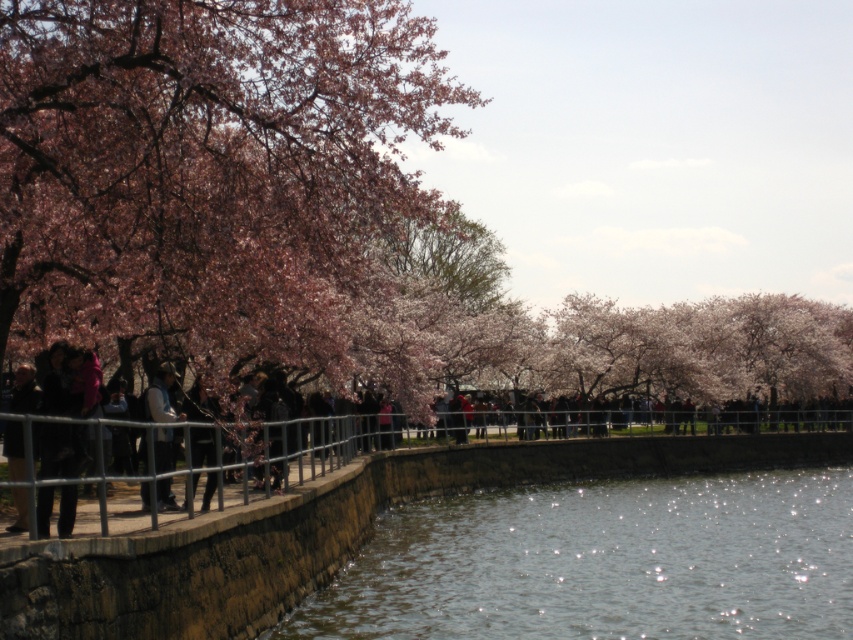
You are standing on the walkway and want to reach both the point at coordinates point (33,456) and point (155,390). Which point should you go to first to minimize your walking distance?

You should go to point (33,456) first because it is closer to the viewer than point (155,390), so it requires less walking distance.

You are a photographer standing on the walkway near the water. You want to take a photo that includes both the dark brown leather jacket at left and the denim jacket at center. Given that your camera has a maximum focus range of 9 feet, will you be able to capture both subjects in the same frame without moving?

The distance between the dark brown leather jacket at left and denim jacket at center is 8.99 feet, which is within the camera maximum focus range of 9 feet. Yes, you can capture both subjects in the same frame without moving.

Based on the photo, you are standing at the center of the walkway and want to take a photo of the pink blossoms at left. In which direction should you move to get closer to them?

The pink blossoms at left are located at point (x=207, y=173), so you should move to the left to get closer to them.